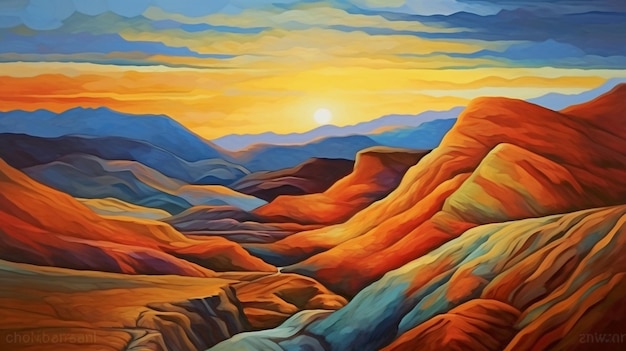
The height and width of the screenshot is (351, 626). I want to click on painting, so pos(394,203).